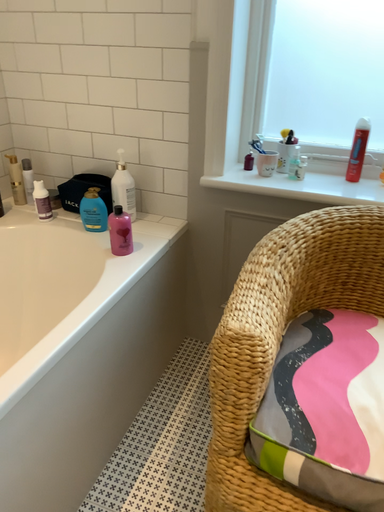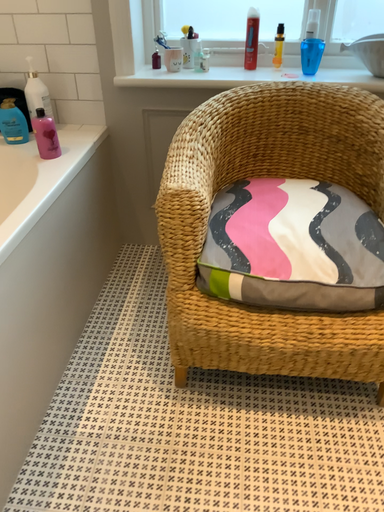
Question: How did the camera likely rotate when shooting the video?

Choices:
 (A) rotated right
 (B) rotated left

Answer: (A)